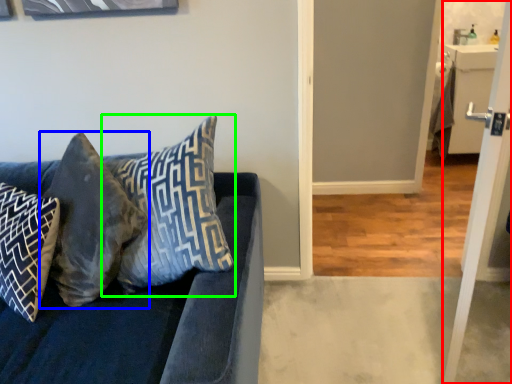
Question: Which is nearer to the screen door (highlighted by a red box)? pillow (highlighted by a blue box) or pillow (highlighted by a green box).

Choices:
 (A) pillow
 (B) pillow

Answer: (B)